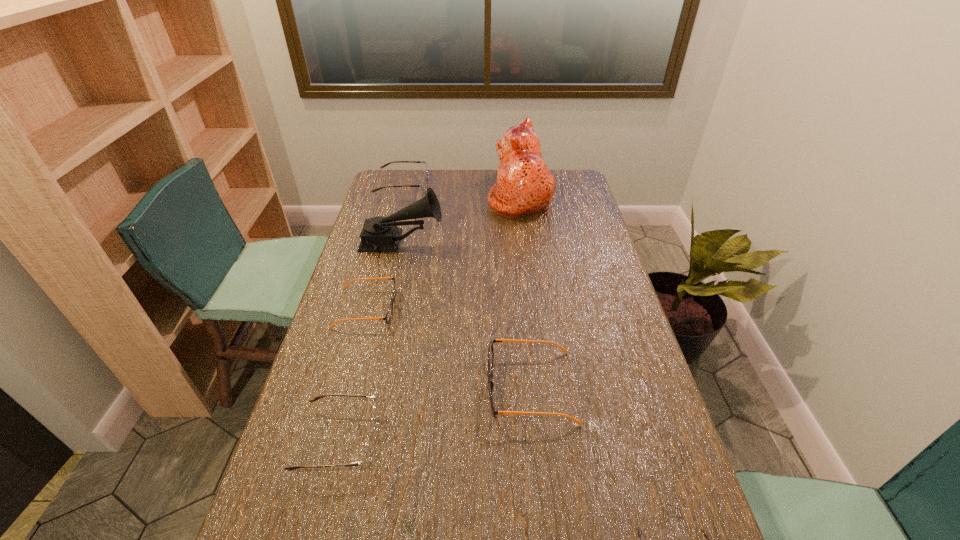
You are a GUI agent. You are given a task and a screenshot of the screen. Output one action in this format:
    pyautogui.click(x=<x>, y=<y>)
    Task: Click on the vacant space located 0.330m on the face of the tallest object
    
    Given the screenshot: What is the action you would take?
    pyautogui.click(x=409, y=194)

This screenshot has height=540, width=960. Identify the location of free point located on the face of the tallest object. (395, 194).

The height and width of the screenshot is (540, 960). In order to click on blank area located 0.300m on the face of the tallest object in this screenshot , I will do `click(416, 194)`.

The width and height of the screenshot is (960, 540). In order to click on vacant region located from the horn of the second tallest object in this screenshot , I will do `click(543, 242)`.

Identify the location of vacant space situated on the front-facing side of the farthest spectacles. (470, 186).

The height and width of the screenshot is (540, 960). I want to click on vacant space located on the front-facing side of the bigger black spectacles, so click(417, 387).

I want to click on free space located on the front-facing side of the bigger black spectacles, so click(x=401, y=387).

Locate an element on the screen. vacant space located on the front-facing side of the bigger black spectacles is located at coordinates (432, 387).

The width and height of the screenshot is (960, 540). Find the location of `free location located 0.260m on the front-facing side of the second nearest brown spectacles`. free location located 0.260m on the front-facing side of the second nearest brown spectacles is located at coordinates (490, 440).

I want to click on vacant point located on the front-facing side of the fourth nearest object, so click(439, 308).